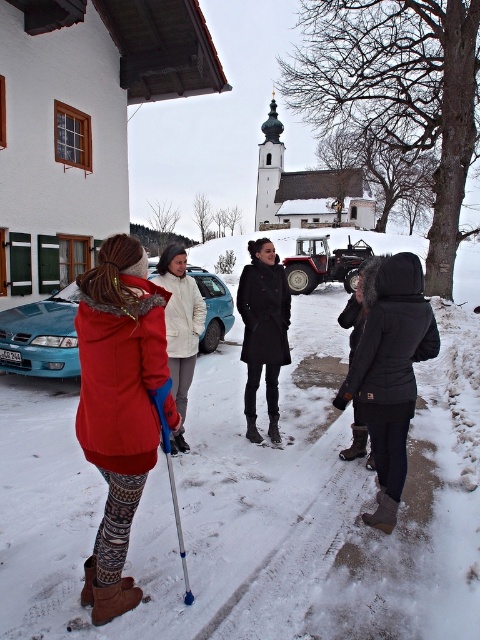
You are a photographer trying to capture a photo of the black matte coat at center and the metallic blue ski pole at lower center. Based on their positions, which object should you focus on first to ensure both are in the frame without moving the camera?

The black matte coat at center is above the metallic blue ski pole at lower center, so you should focus on the black matte coat at center first to ensure both are in the frame without moving the camera.

You are a photographer trying to capture a group photo of the two people in the scene. The camera you have can only focus on subjects within a 1.5 meter range. Given the distance between the red fleece jacket at lower left and the black synthetic jacket at lower right, will both individuals be in focus if you position the camera between them?

The red fleece jacket at lower left is 1.69 meters away from the black synthetic jacket at lower right. Since the camera can only focus within 1.5 meters, the distance between them exceeds the focus range. Therefore, both individuals will not be in focus simultaneously.

You are a photographer trying to capture a clear photo of the black matte coat at center without the metallic blue ski pole at lower center blocking it. Based on their positions, which direction should you move your camera to avoid the ski pole?

The metallic blue ski pole at lower center is behind the black matte coat at center, so moving the camera slightly forward towards the black matte coat at center would allow you to capture it without the ski pole blocking the view.